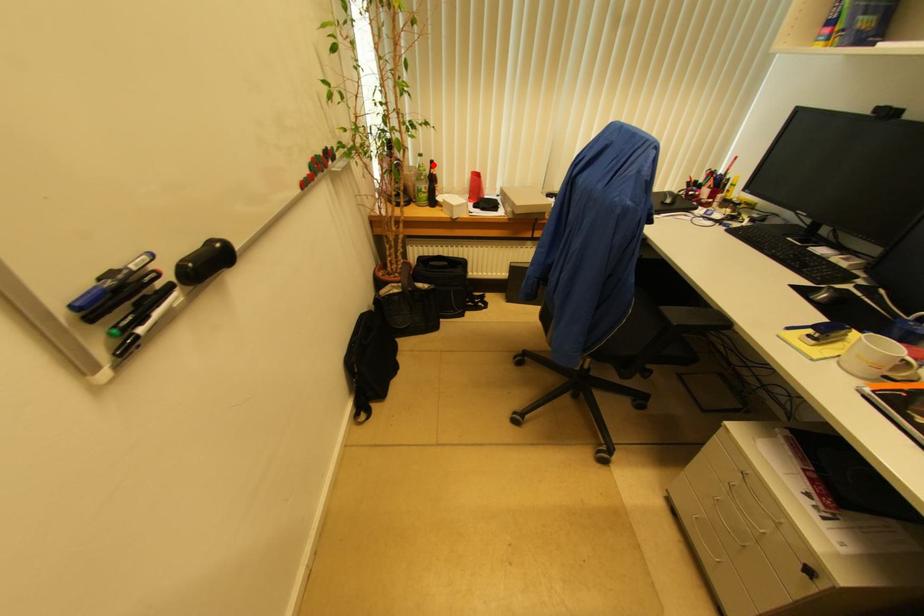
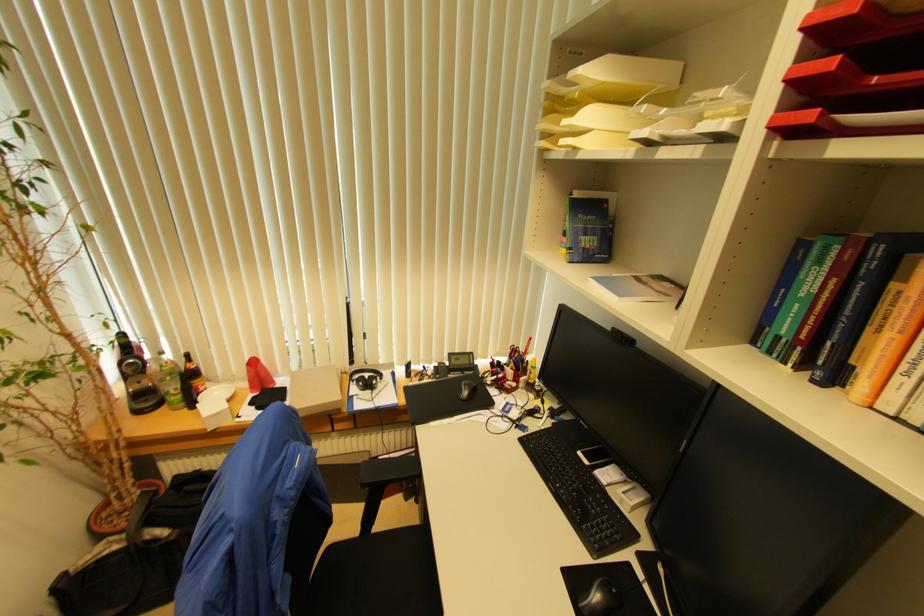
Question: I am providing you with two images of the same scene from different viewpoints. Image1 has a red point marked. In image2, the corresponding 3D location appears at what relative position? Reply with the corresponding letter.

Choices:
 (A) Closer
 (B) Farther

Answer: (B)